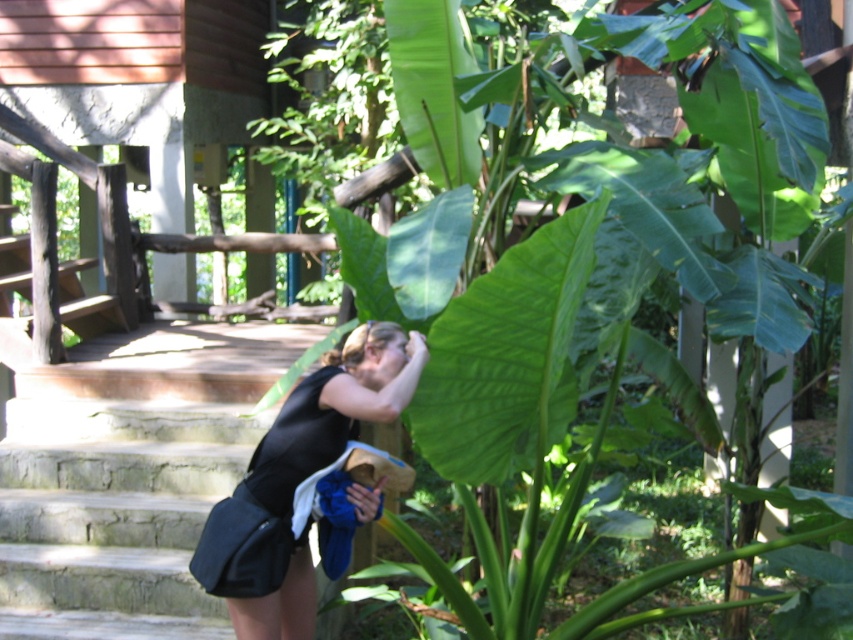
Question: Is green leafy plant at center thinner than black matte skirt at lower center?

Choices:
 (A) no
 (B) yes

Answer: (A)

Question: Is stone stairs at lower left to the left of black matte skirt at lower center from the viewer's perspective?

Choices:
 (A) yes
 (B) no

Answer: (A)

Question: Which point is farther to the camera?

Choices:
 (A) stone stairs at lower left
 (B) green leafy plant at center

Answer: (A)

Question: Can you confirm if green leafy plant at center is thinner than stone stairs at lower left?

Choices:
 (A) yes
 (B) no

Answer: (B)

Question: Estimate the real-world distances between objects in this image. Which object is farther from the stone stairs at lower left?

Choices:
 (A) green leafy plant at center
 (B) black matte skirt at lower center

Answer: (A)

Question: Which of these objects is positioned farthest from the black matte skirt at lower center?

Choices:
 (A) green leafy plant at center
 (B) stone stairs at lower left

Answer: (B)